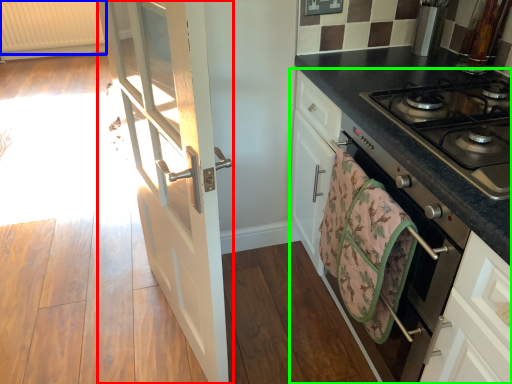
Question: Estimate the real-world distances between objects in this image. Which object is farther from door (highlighted by a red box), radiator (highlighted by a blue box) or cabinetry (highlighted by a green box)?

Choices:
 (A) radiator
 (B) cabinetry

Answer: (A)